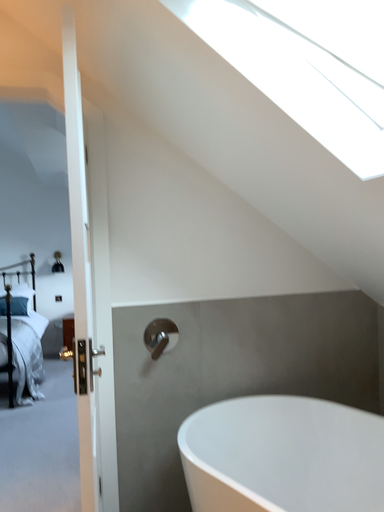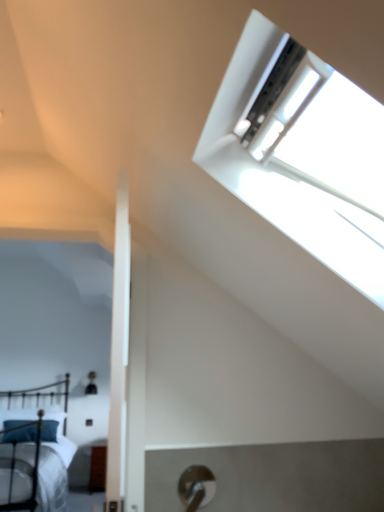
Question: Which way did the camera rotate in the video?

Choices:
 (A) rotated upward
 (B) rotated downward

Answer: (A)